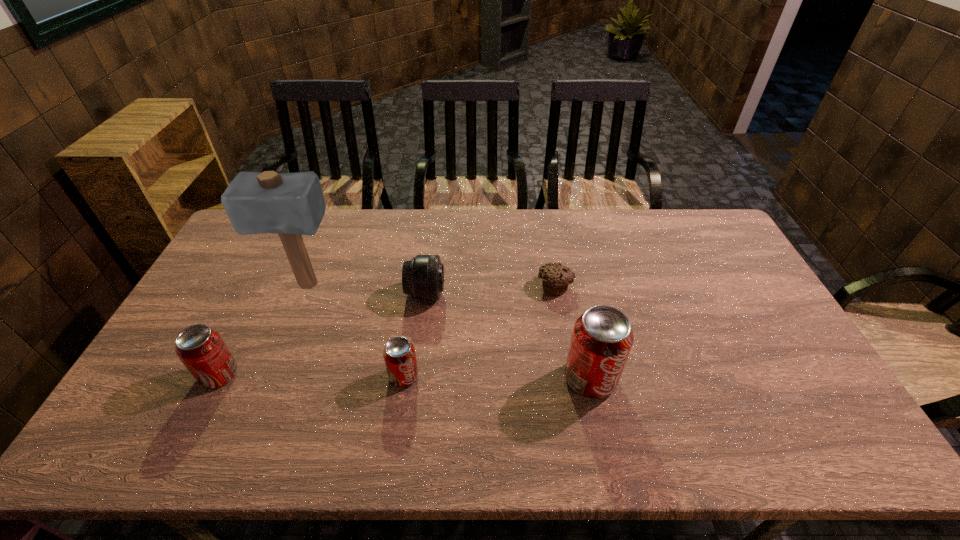
I want to click on the second tallest soda can, so click(x=200, y=348).

Find the location of a particular element. This screenshot has width=960, height=540. the second soda can from left to right is located at coordinates (399, 354).

Where is `the tallest soda can`? the tallest soda can is located at coordinates (602, 338).

Find the location of `the fifth shortest object`. the fifth shortest object is located at coordinates (602, 338).

The height and width of the screenshot is (540, 960). What are the coordinates of `telephoto lens` in the screenshot? It's located at (422, 277).

The height and width of the screenshot is (540, 960). I want to click on mallet, so click(291, 204).

Image resolution: width=960 pixels, height=540 pixels. Identify the location of muffin. (556, 278).

Locate an element on the screen. The height and width of the screenshot is (540, 960). vacant space located 0.210m on the back of the second shortest soda can is located at coordinates (255, 303).

You are a GUI agent. You are given a task and a screenshot of the screen. Output one action in this format:
    pyautogui.click(x=<x>, y=<y>)
    Task: Click on the vacant space located on the back of the shortest soda can
    The width and height of the screenshot is (960, 540).
    Given the screenshot: What is the action you would take?
    pyautogui.click(x=411, y=327)

You are a GUI agent. You are given a task and a screenshot of the screen. Output one action in this format:
    pyautogui.click(x=<x>, y=<y>)
    Task: Click on the free space located on the right of the second tallest object
    The height and width of the screenshot is (540, 960).
    Given the screenshot: What is the action you would take?
    pyautogui.click(x=714, y=379)